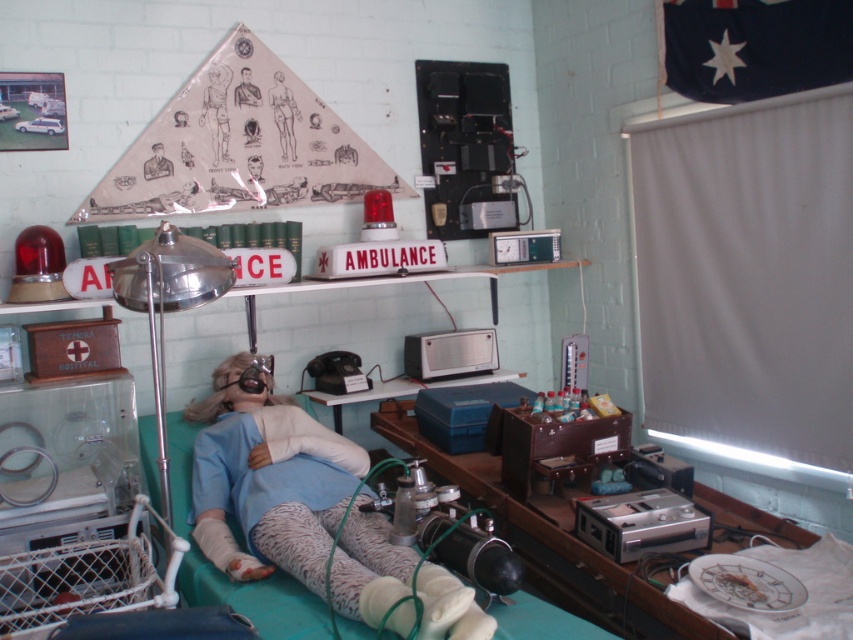
Looking at this image, between matte plastic figure at upper center and metallic silver ambulance sign at upper center, which one appears on the left side from the viewer's perspective?

From the viewer's perspective, metallic silver ambulance sign at upper center appears more on the left side.

Who is more distant from viewer, (210, 67) or (42, 120)?

The point (210, 67) is behind.

The width and height of the screenshot is (853, 640). What are the coordinates of `matte plastic figure at upper center` in the screenshot? It's located at (218, 109).

Does blue fabric doll at center appear over matte plastic figure at upper center?

Actually, blue fabric doll at center is below matte plastic figure at upper center.

Which is more to the left, blue fabric doll at center or matte plastic figure at upper center?

matte plastic figure at upper center is more to the left.

This screenshot has width=853, height=640. Describe the element at coordinates (288, 497) in the screenshot. I see `blue fabric doll at center` at that location.

I want to click on blue fabric doll at center, so click(288, 497).

Does matte plastic figure at upper center appear under matte paper figure at center?

Correct, matte plastic figure at upper center is located below matte paper figure at center.

Is point (201, 108) in front of point (283, 134)?

Yes, it is.

Is point (219, 124) closer to viewer compared to point (280, 80)?

Yes, point (219, 124) is closer to viewer.

Find the location of `matte plastic figure at upper center`. matte plastic figure at upper center is located at coordinates (218, 109).